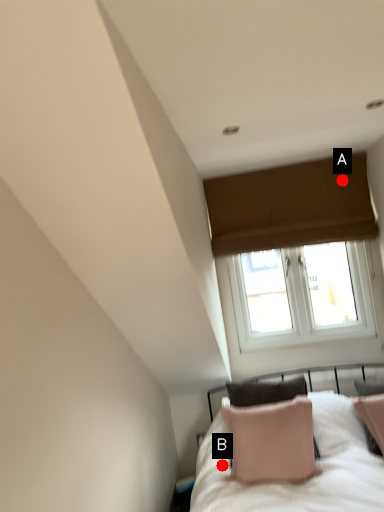
Question: Two points are circled on the image, labeled by A and B beside each circle. Which point is farther from the camera taking this photo?

Choices:
 (A) A is further
 (B) B is further

Answer: (A)